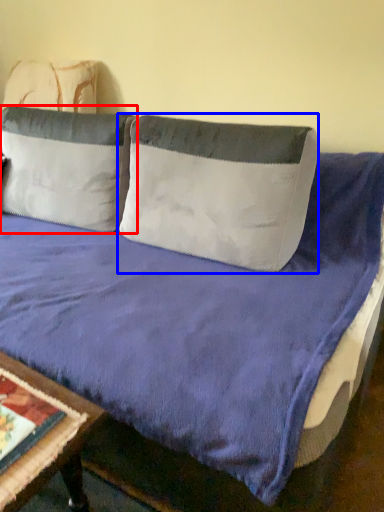
Question: Which object is closer to the camera taking this photo, pillow (highlighted by a red box) or pillow (highlighted by a blue box)?

Choices:
 (A) pillow
 (B) pillow

Answer: (B)